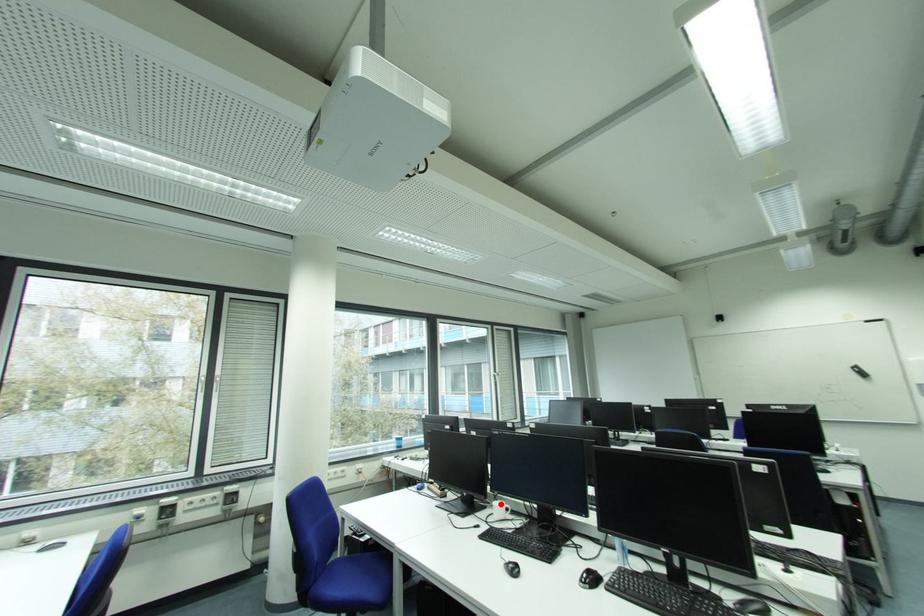
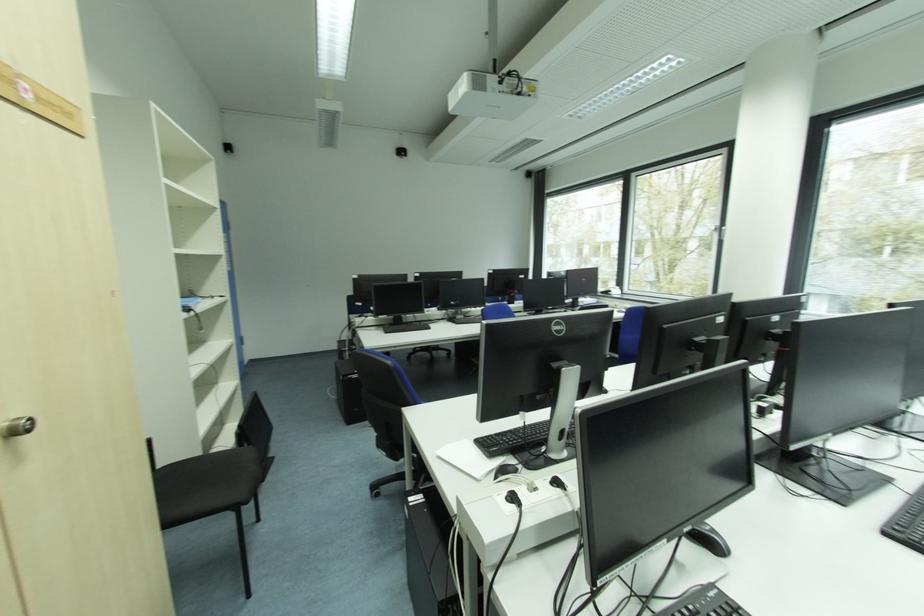
Question: I am providing you with two images of the same scene from different viewpoints. A red point is marked on the first image. Can you still see the location of the red point in image 2?

Choices:
 (A) Yes
 (B) No

Answer: (B)